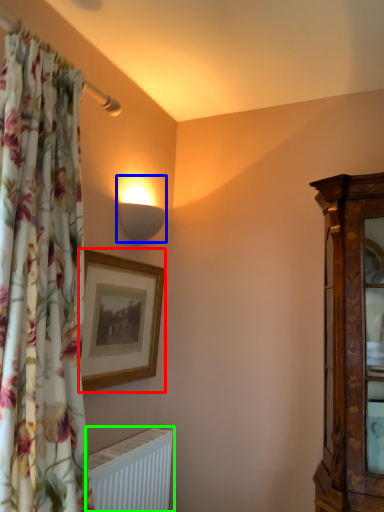
Question: Which is nearer to the picture frame (highlighted by a red box)? lamp (highlighted by a blue box) or radiator (highlighted by a green box).

Choices:
 (A) lamp
 (B) radiator

Answer: (A)